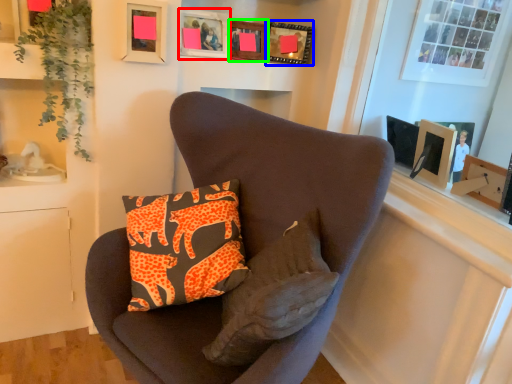
Question: Based on their relative distances, which object is nearer to picture frame (highlighted by a red box)? Choose from picture frame (highlighted by a blue box) and picture frame (highlighted by a green box).

Choices:
 (A) picture frame
 (B) picture frame

Answer: (B)